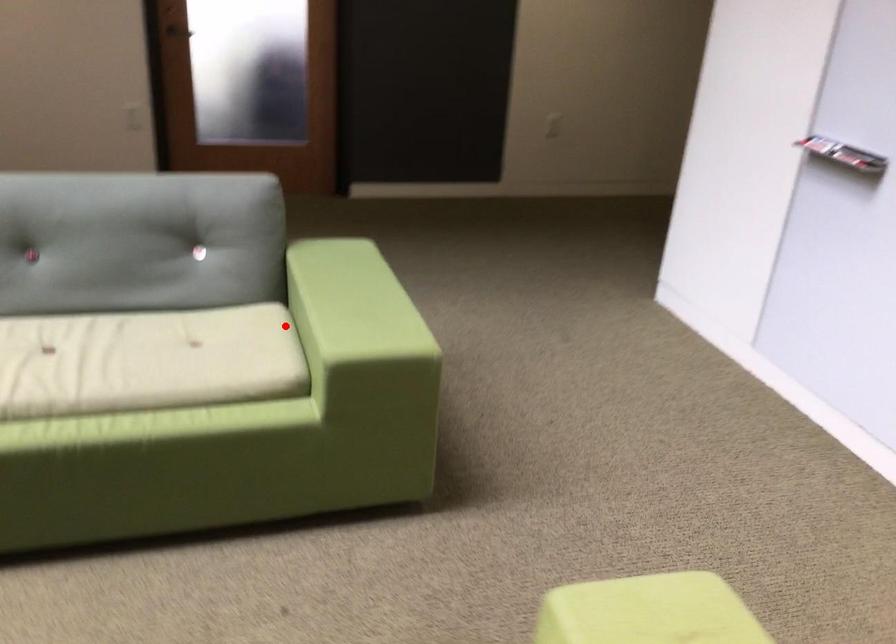
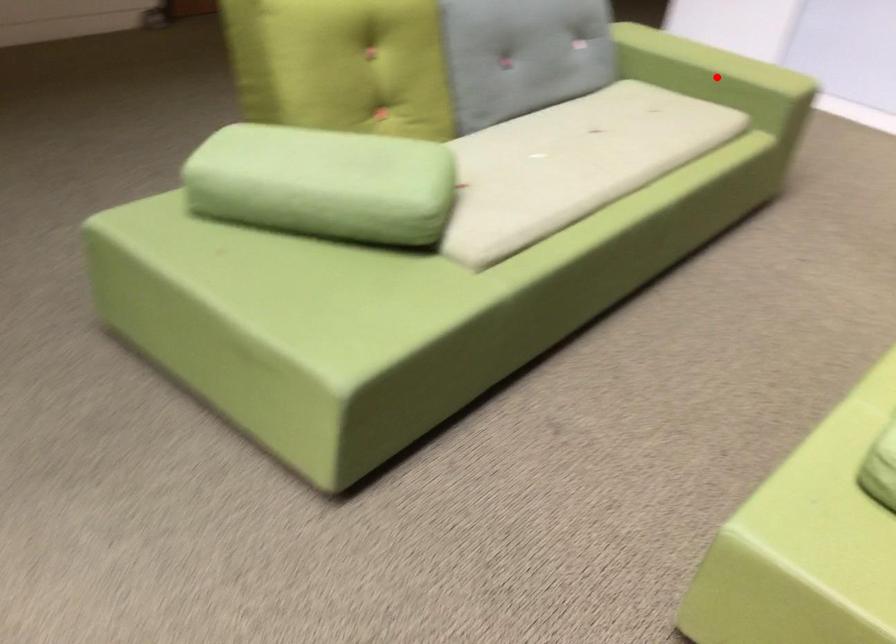
I am providing you with two images of the same scene from different viewpoints. A red point is marked on the first image and another point is marked on the second image. Does the point marked in image1 correspond to the same location as the one in image2?

Yes